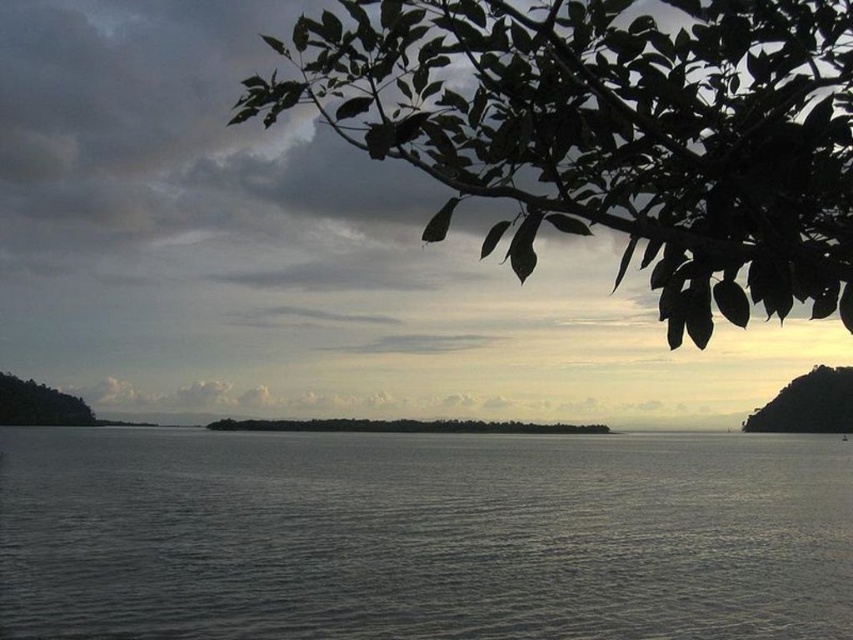
Is point (643, 92) positioned before point (520, 432)?

That is True.

Where is `green leafy branch at upper right`? The width and height of the screenshot is (853, 640). green leafy branch at upper right is located at coordinates (614, 132).

Measure the distance between green leafy branch at upper right and camera.

2.82 meters

Locate an element on the screen. green leafy branch at upper right is located at coordinates (614, 132).

Does point (398, 605) come in front of point (18, 400)?

Yes, it is in front of point (18, 400).

Is gray water at center bigger than green leafy tree at left?

Indeed, gray water at center has a larger size compared to green leafy tree at left.

Locate an element on the screen. gray water at center is located at coordinates (422, 536).

This screenshot has height=640, width=853. Identify the location of gray water at center. (422, 536).

The height and width of the screenshot is (640, 853). What do you see at coordinates (402, 426) in the screenshot?
I see `green leafy tree at center` at bounding box center [402, 426].

I want to click on green leafy tree at center, so click(402, 426).

Where is `green leafy tree at center`? This screenshot has width=853, height=640. green leafy tree at center is located at coordinates (402, 426).

The height and width of the screenshot is (640, 853). In order to click on green leafy tree at center in this screenshot , I will do `click(402, 426)`.